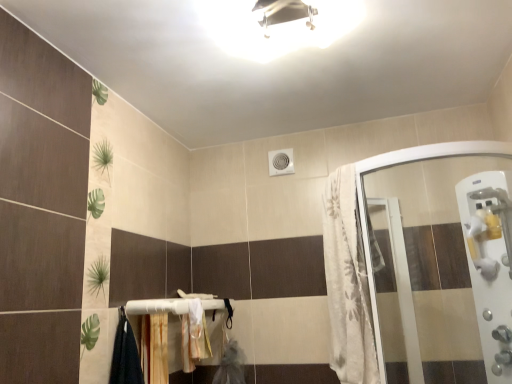
Question: Is white fabric bath towel at lower center taller than white plastic handle at right?

Choices:
 (A) yes
 (B) no

Answer: (B)

Question: Considering the relative sizes of white fabric bath towel at lower center and white plastic handle at right in the image provided, is white fabric bath towel at lower center wider than white plastic handle at right?

Choices:
 (A) no
 (B) yes

Answer: (A)

Question: From a real-world perspective, is white fabric bath towel at lower center over white plastic handle at right?

Choices:
 (A) yes
 (B) no

Answer: (B)

Question: Is white plastic handle at right completely or partially inside white fabric bath towel at lower center?

Choices:
 (A) no
 (B) yes

Answer: (A)

Question: Is white fabric bath towel at lower center bigger than white plastic handle at right?

Choices:
 (A) no
 (B) yes

Answer: (A)

Question: Which is correct: white textured fabric at right is inside white glossy light fixture at upper center, or outside of it?

Choices:
 (A) outside
 (B) inside

Answer: (A)

Question: Considering the relative positions of white textured fabric at right and white glossy light fixture at upper center in the image provided, is white textured fabric at right to the left or to the right of white glossy light fixture at upper center?

Choices:
 (A) left
 (B) right

Answer: (B)

Question: In the image, is white textured fabric at right positioned in front of or behind white glossy light fixture at upper center?

Choices:
 (A) behind
 (B) front

Answer: (A)

Question: From the image's perspective, is white textured fabric at right above or below white glossy light fixture at upper center?

Choices:
 (A) above
 (B) below

Answer: (B)

Question: In the image, is white glossy light fixture at upper center on the left side or the right side of white fabric bath towel at lower center?

Choices:
 (A) right
 (B) left

Answer: (A)

Question: Is point (355, 14) closer or farther from the camera than point (195, 331)?

Choices:
 (A) farther
 (B) closer

Answer: (B)

Question: Would you say white glossy light fixture at upper center is inside or outside white fabric bath towel at lower center?

Choices:
 (A) inside
 (B) outside

Answer: (B)

Question: In terms of height, does white glossy light fixture at upper center look taller or shorter compared to white fabric bath towel at lower center?

Choices:
 (A) tall
 (B) short

Answer: (B)

Question: Is white glossy light fixture at upper center taller or shorter than wooden at lower center?

Choices:
 (A) tall
 (B) short

Answer: (B)

Question: Considering the positions of point (238, 6) and point (147, 329), is point (238, 6) closer or farther from the camera than point (147, 329)?

Choices:
 (A) closer
 (B) farther

Answer: (A)